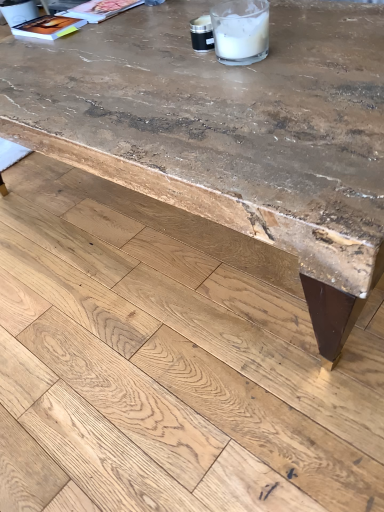
Question: Is matte paper magazine at upper left, which ranks as the second magazine in left-to-right order, far away from clear plastic straw at upper center?

Choices:
 (A) yes
 (B) no

Answer: (B)

Question: Is matte paper magazine at upper left, which ranks as the second magazine in left-to-right order, located outside clear plastic straw at upper center?

Choices:
 (A) yes
 (B) no

Answer: (A)

Question: Is matte paper magazine at upper left, which ranks as the second magazine in left-to-right order, smaller than clear plastic straw at upper center?

Choices:
 (A) yes
 (B) no

Answer: (B)

Question: Can you confirm if matte paper magazine at upper left, the 1th magazine when ordered from right to left, is bigger than clear plastic straw at upper center?

Choices:
 (A) no
 (B) yes

Answer: (B)

Question: Considering the relative sizes of matte paper magazine at upper left, which ranks as the second magazine in left-to-right order, and clear plastic straw at upper center in the image provided, is matte paper magazine at upper left, which ranks as the second magazine in left-to-right order, thinner than clear plastic straw at upper center?

Choices:
 (A) yes
 (B) no

Answer: (B)

Question: From the image's perspective, does matte paper magazine at upper left, which ranks as the second magazine in left-to-right order, appear higher than clear plastic straw at upper center?

Choices:
 (A) yes
 (B) no

Answer: (A)

Question: From a real-world perspective, is rustic wood table at center located higher than matte paper magazine at upper left, which ranks as the second magazine in left-to-right order?

Choices:
 (A) yes
 (B) no

Answer: (B)

Question: Does rustic wood table at center appear on the right side of matte paper magazine at upper left, which ranks as the second magazine in left-to-right order?

Choices:
 (A) no
 (B) yes

Answer: (B)

Question: Can you confirm if rustic wood table at center is bigger than matte paper magazine at upper left, which ranks as the second magazine in left-to-right order?

Choices:
 (A) no
 (B) yes

Answer: (B)

Question: Considering the relative sizes of rustic wood table at center and matte paper magazine at upper left, which ranks as the second magazine in left-to-right order, in the image provided, is rustic wood table at center thinner than matte paper magazine at upper left, which ranks as the second magazine in left-to-right order,?

Choices:
 (A) no
 (B) yes

Answer: (A)

Question: From the image's perspective, is rustic wood table at center over matte paper magazine at upper left, which ranks as the second magazine in left-to-right order?

Choices:
 (A) no
 (B) yes

Answer: (A)

Question: Is the position of rustic wood table at center less distant than that of matte paper magazine at upper left, the 1th magazine when ordered from right to left?

Choices:
 (A) yes
 (B) no

Answer: (A)

Question: Considering the relative sizes of matte paper magazine at upper left, the 1th magazine when ordered from right to left, and rough concrete table at upper center in the image provided, is matte paper magazine at upper left, the 1th magazine when ordered from right to left, wider than rough concrete table at upper center?

Choices:
 (A) no
 (B) yes

Answer: (A)